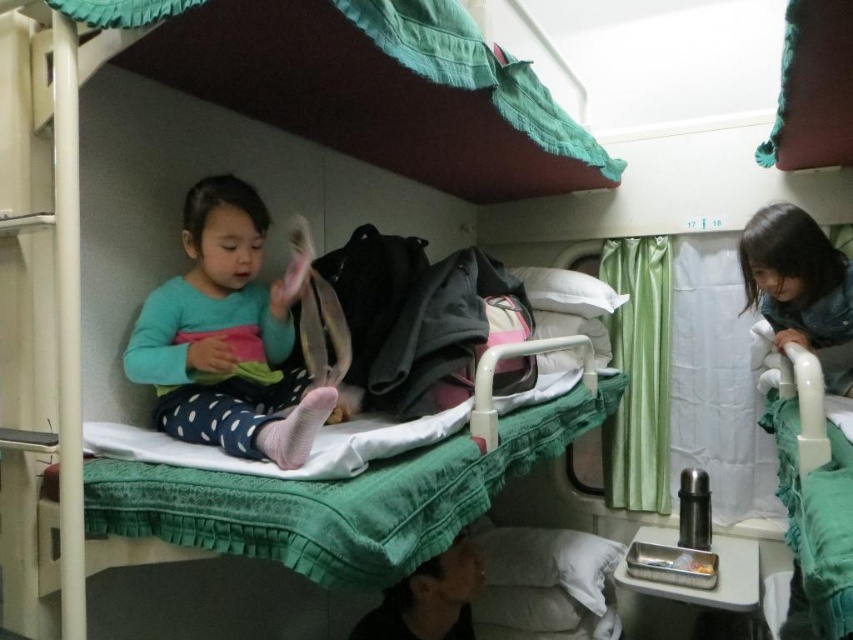
From the picture: You are a traveler with a backpack that is 25 inches long. You want to place it between the green satin curtain at right and the smooth denim jacket at upper right. Is there enough space?

The distance between the green satin curtain at right and the smooth denim jacket at upper right is 27.09 inches, so yes, the backpack can fit as it is shorter than the available space.

You are a traveler trying to decide whether to hang your new backpack on the green satin curtain at right or the smooth denim jacket at upper right. Which one can hold more weight without tearing?

The smooth denim jacket at upper right can hold more weight without tearing because it is wider than the green satin curtain at right.